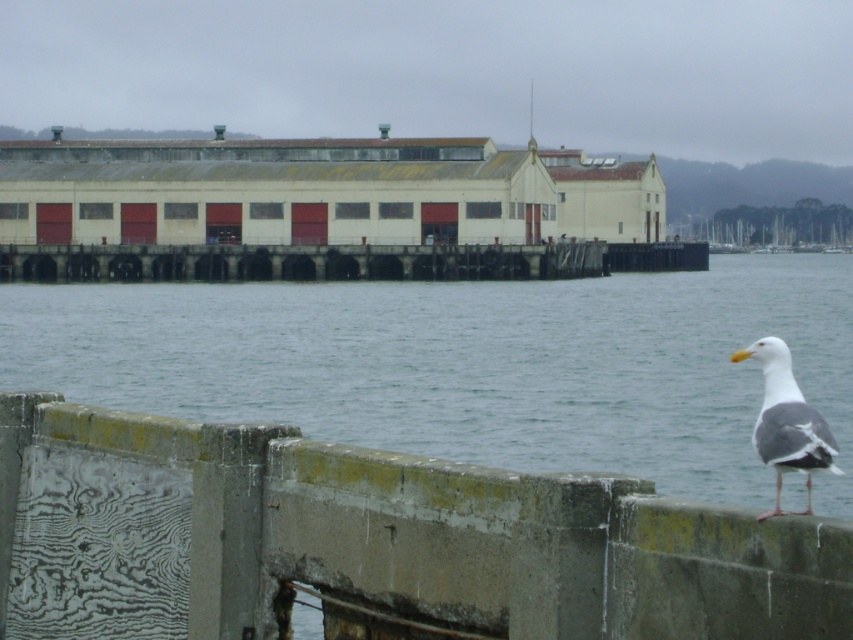
Question: Can you confirm if clear water at lower center is positioned to the left of weathered wood dock at center?

Choices:
 (A) yes
 (B) no

Answer: (A)

Question: Which point is closer to the camera taking this photo?

Choices:
 (A) 97,253
 (B) 757,340
 (C) 747,529
 (D) 173,388

Answer: (C)

Question: Does clear water at lower center appear over white feathered seagull at lower right?

Choices:
 (A) yes
 (B) no

Answer: (A)

Question: Which of the following is the farthest from the observer?

Choices:
 (A) white feathered seagull at lower right
 (B) wooden textured rail at lower right
 (C) clear water at lower center

Answer: (C)

Question: From the image, what is the correct spatial relationship of wooden textured rail at lower right in relation to weathered wood dock at center?

Choices:
 (A) right
 (B) left

Answer: (B)

Question: Estimate the real-world distances between objects in this image. Which object is farther from the weathered wood dock at center?

Choices:
 (A) clear water at lower center
 (B) wooden textured rail at lower right
 (C) white feathered seagull at lower right

Answer: (B)